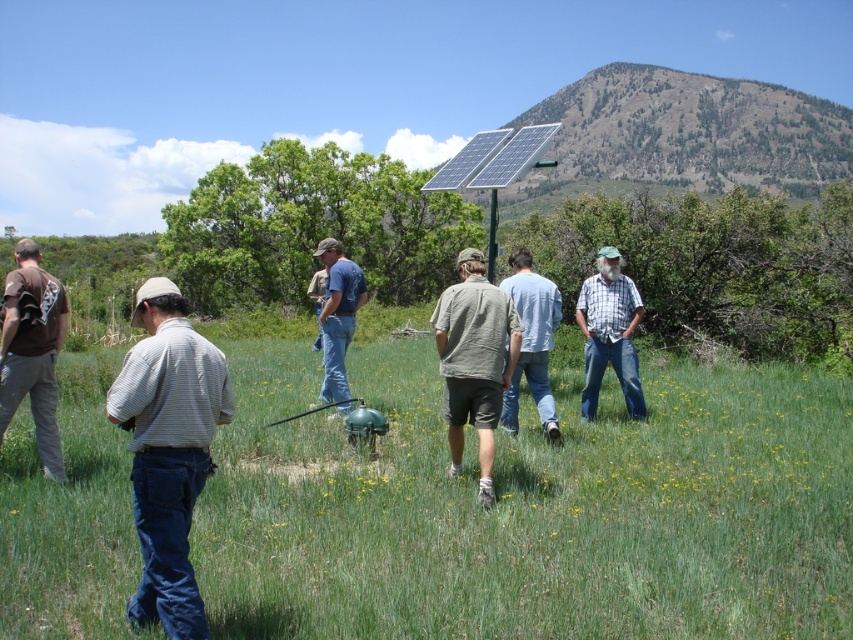
Question: Which object is the closest to the light blue cotton shirt at center?

Choices:
 (A) white striped shirt at left
 (B) blue plaid shirt at center

Answer: (B)

Question: Is green grass at center positioned before light brown cotton shirt at center?

Choices:
 (A) yes
 (B) no

Answer: (A)

Question: Which is farther from the denim jeans at center?

Choices:
 (A) light blue cotton shirt at center
 (B) matte brown shirt at left
 (C) blue plaid shirt at center

Answer: (B)

Question: Which of the following is the closest to the observer?

Choices:
 (A) white striped shirt at left
 (B) light blue cotton shirt at center
 (C) blue plaid shirt at center
 (D) green grass at center

Answer: (A)

Question: Is white striped shirt at left positioned in front of light brown cotton shirt at center?

Choices:
 (A) yes
 (B) no

Answer: (A)

Question: Is green grass at center above light blue cotton shirt at center?

Choices:
 (A) no
 (B) yes

Answer: (A)